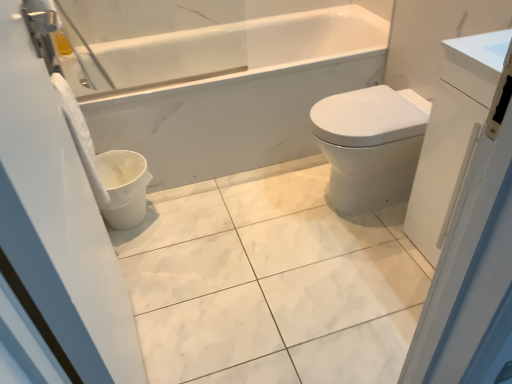
In order to click on vacant area that lies between white glossy screen door at left, placed as the second screen door when sorted from right to left, and white glossy bidet at right in this screenshot , I will do `click(258, 277)`.